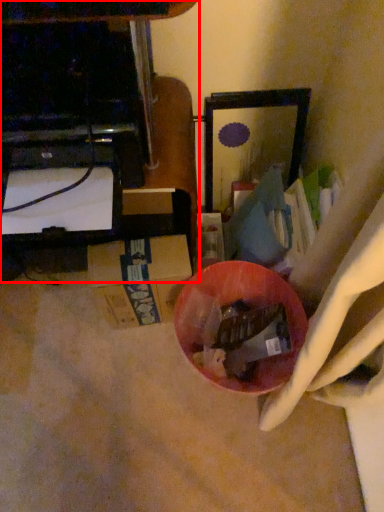
Question: Considering the relative positions of furniture (annotated by the red box) and bowl in the image provided, where is furniture (annotated by the red box) located with respect to the staircase?

Choices:
 (A) left
 (B) right

Answer: (A)